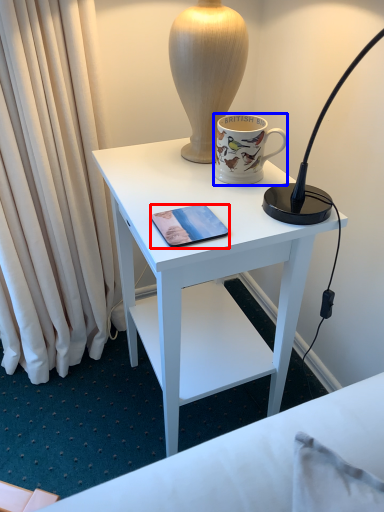
Question: Which object appears farthest to the camera in this image, mobile phone (highlighted by a red box) or coffee cup (highlighted by a blue box)?

Choices:
 (A) mobile phone
 (B) coffee cup

Answer: (B)